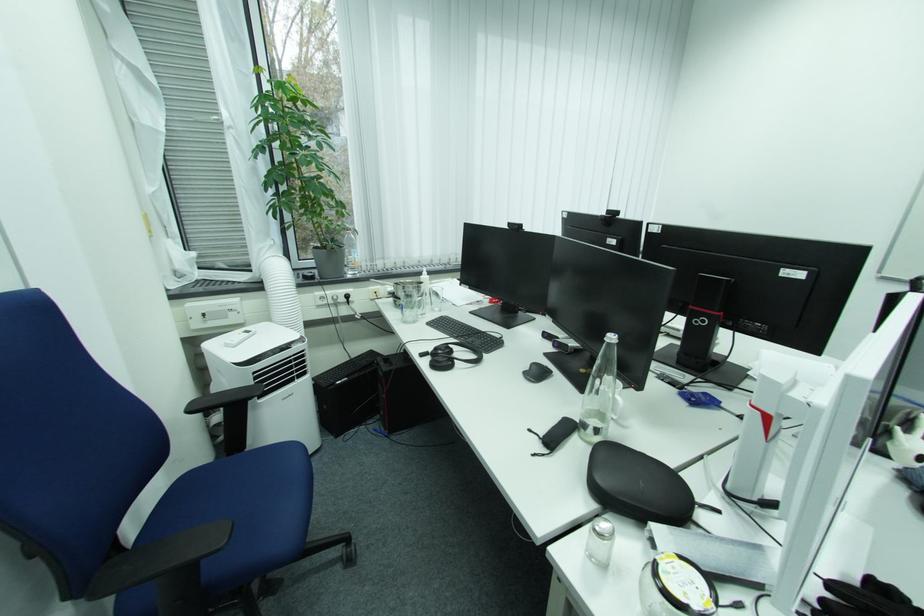
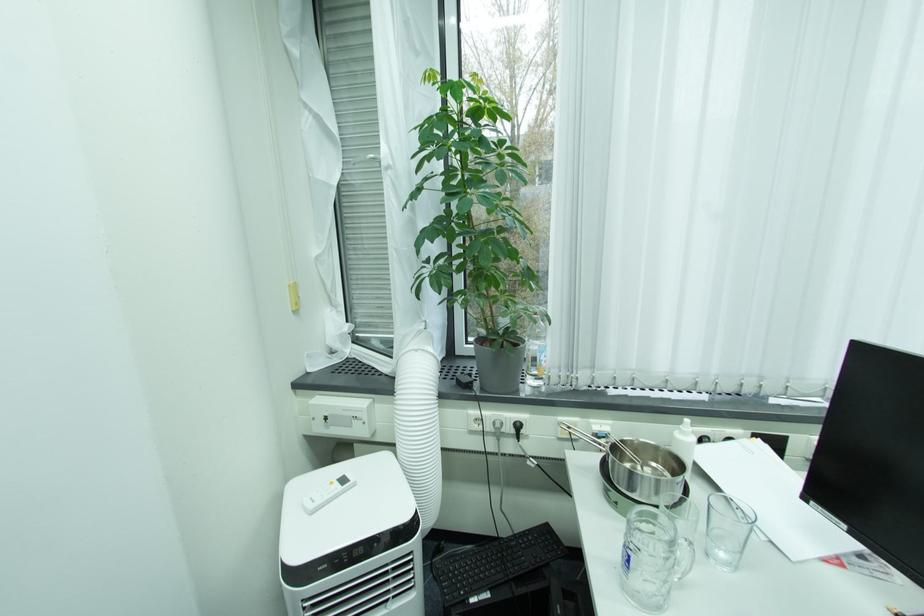
Question: The images are taken continuously from a first-person perspective. In which direction is your viewpoint rotating?

Choices:
 (A) Left
 (B) Right
 (C) Up
 (D) Down

Answer: (A)